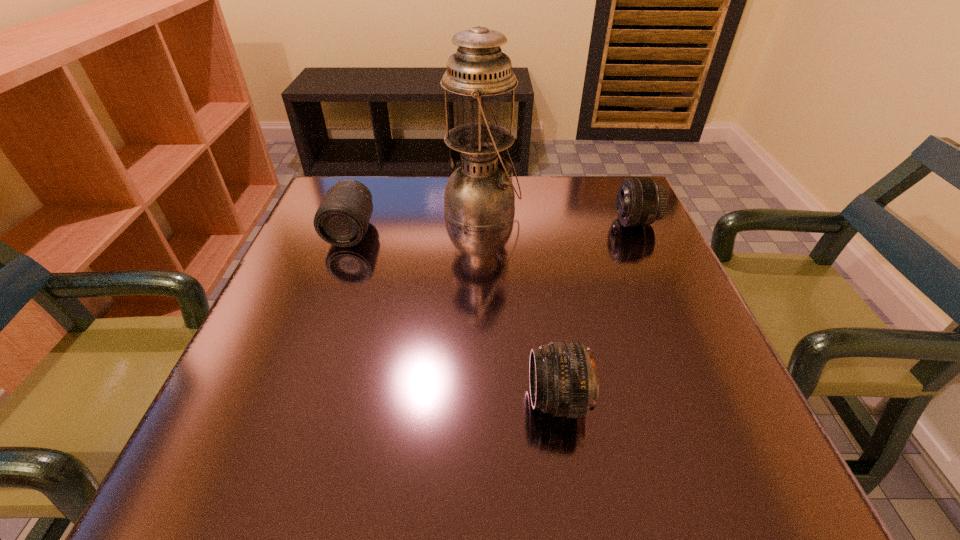
Where is `vacant area between the leftmost object and the oil lamp`? The width and height of the screenshot is (960, 540). vacant area between the leftmost object and the oil lamp is located at coordinates (417, 221).

Where is `free spot between the oil lamp and the leftmost telephoto lens`? The height and width of the screenshot is (540, 960). free spot between the oil lamp and the leftmost telephoto lens is located at coordinates (417, 221).

Where is `free space between the nearest object and the oil lamp`? The width and height of the screenshot is (960, 540). free space between the nearest object and the oil lamp is located at coordinates (x=520, y=305).

Identify which object is the nearest to the rightmost object. Please provide its 2D coordinates. Your answer should be formatted as a tuple, i.e. [(x, y)], where the tuple contains the x and y coordinates of a point satisfying the conditions above.

[(479, 195)]

Identify the location of object that is the nearest to the tallest object. [342, 219].

Identify which telephoto lens is the closest to the second telephoto lens from right to left. Please provide its 2D coordinates. Your answer should be formatted as a tuple, i.e. [(x, y)], where the tuple contains the x and y coordinates of a point satisfying the conditions above.

[(640, 202)]

Select which telephoto lens appears as the second closest to the leftmost object. Please provide its 2D coordinates. Your answer should be formatted as a tuple, i.e. [(x, y)], where the tuple contains the x and y coordinates of a point satisfying the conditions above.

[(640, 202)]

Image resolution: width=960 pixels, height=540 pixels. I want to click on free region that satisfies the following two spatial constraints: 1. on the front-facing side of the rightmost object; 2. on the surface of the leftmost telephoto lens, so click(639, 232).